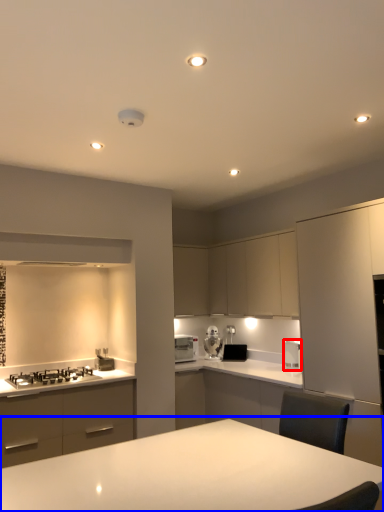
Question: Which object is further to the camera taking this photo, kitchen appliance (highlighted by a red box) or table (highlighted by a blue box)?

Choices:
 (A) kitchen appliance
 (B) table

Answer: (A)